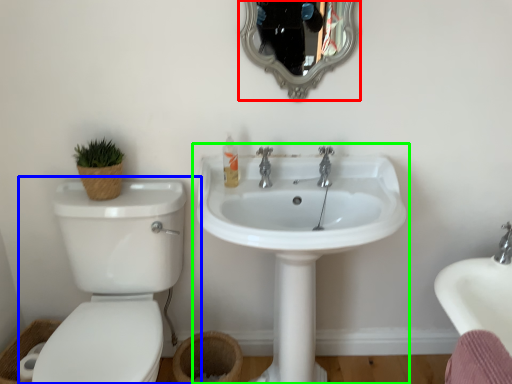
Question: Which object is the closest to the mirror (highlighted by a red box)? Choose among these: toilet (highlighted by a blue box) or sink (highlighted by a green box).

Choices:
 (A) toilet
 (B) sink

Answer: (B)